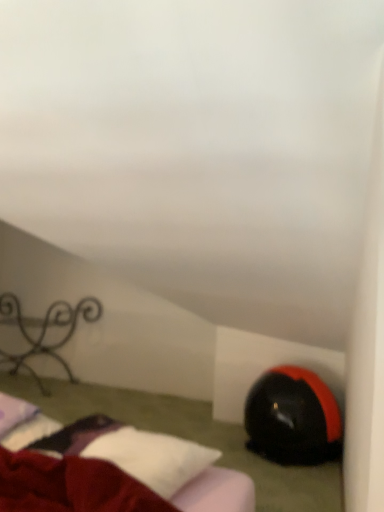
You are a GUI agent. You are given a task and a screenshot of the screen. Output one action in this format:
    pyautogui.click(x=<x>, y=<y>)
    Task: Click on the free location above velvet red bed at lower left (from a real-world perspective)
    This screenshot has width=384, height=512.
    Given the screenshot: What is the action you would take?
    pyautogui.click(x=116, y=442)